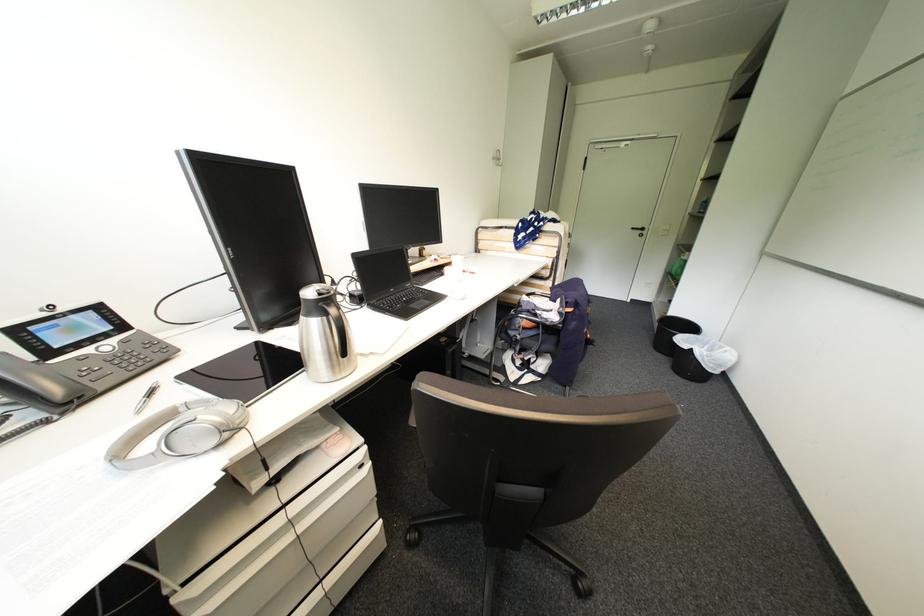
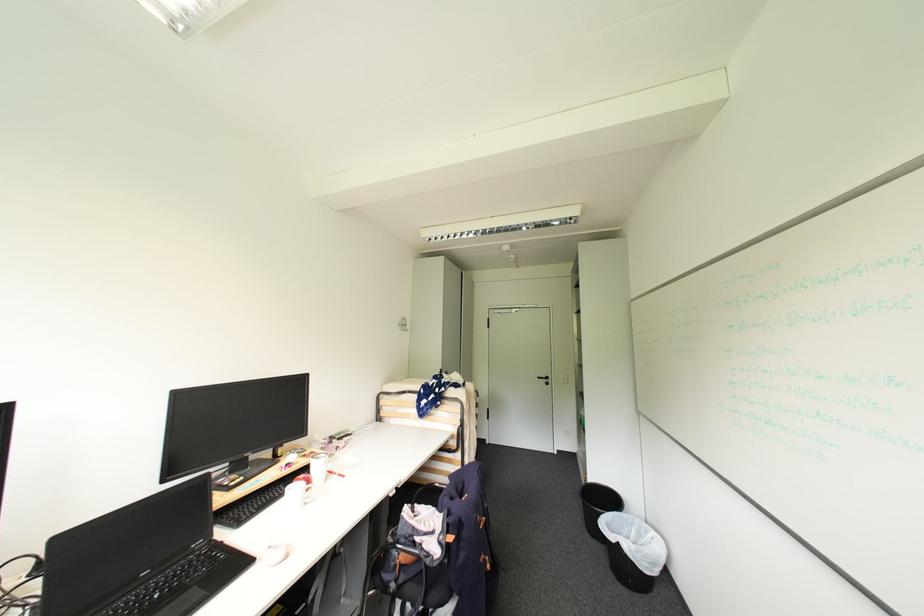
In the second image, find the point that corresponds to the point at 567,310 in the first image.

(447, 538)